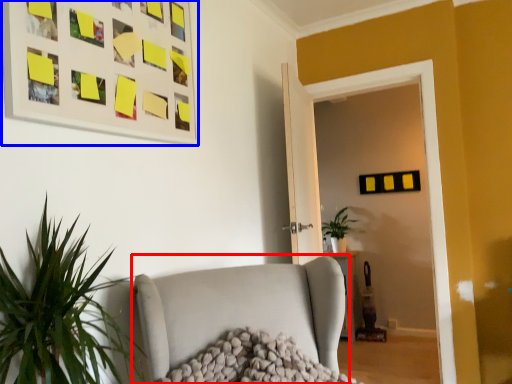
Question: Which object appears farthest to the camera in this image, studio couch (highlighted by a red box) or picture frame (highlighted by a blue box)?

Choices:
 (A) studio couch
 (B) picture frame

Answer: (B)